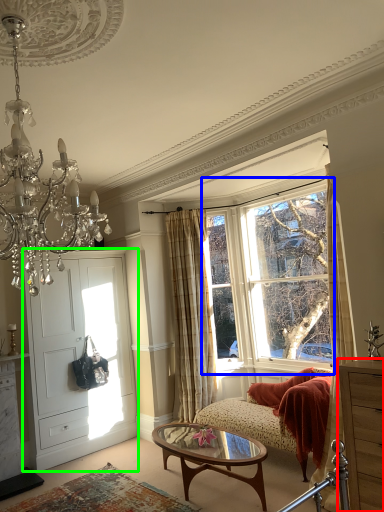
Question: Based on their relative distances, which object is farther from cabinetry (highlighted by a red box)? Choose from window (highlighted by a blue box) and door (highlighted by a green box).

Choices:
 (A) window
 (B) door

Answer: (B)